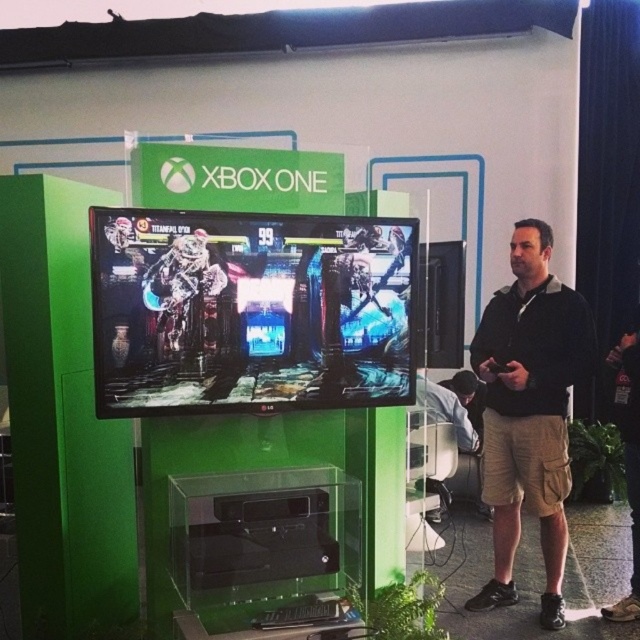
Who is positioned more to the right, shiny metallic screen at center or black cotton shirt at center?

From the viewer's perspective, black cotton shirt at center appears more on the right side.

Find the location of a particular element. This screenshot has height=640, width=640. shiny metallic screen at center is located at coordinates (250, 310).

You are a GUI agent. You are given a task and a screenshot of the screen. Output one action in this format:
    pyautogui.click(x=<x>, y=<y>)
    Task: Click on the shiny metallic screen at center
    
    Given the screenshot: What is the action you would take?
    pyautogui.click(x=250, y=310)